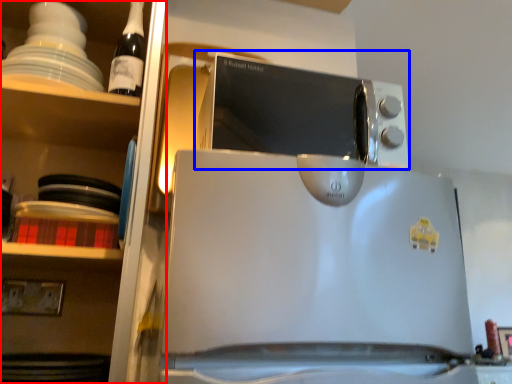
Question: Which object is further to the camera taking this photo, shelf (highlighted by a red box) or microwave oven (highlighted by a blue box)?

Choices:
 (A) shelf
 (B) microwave oven

Answer: (B)